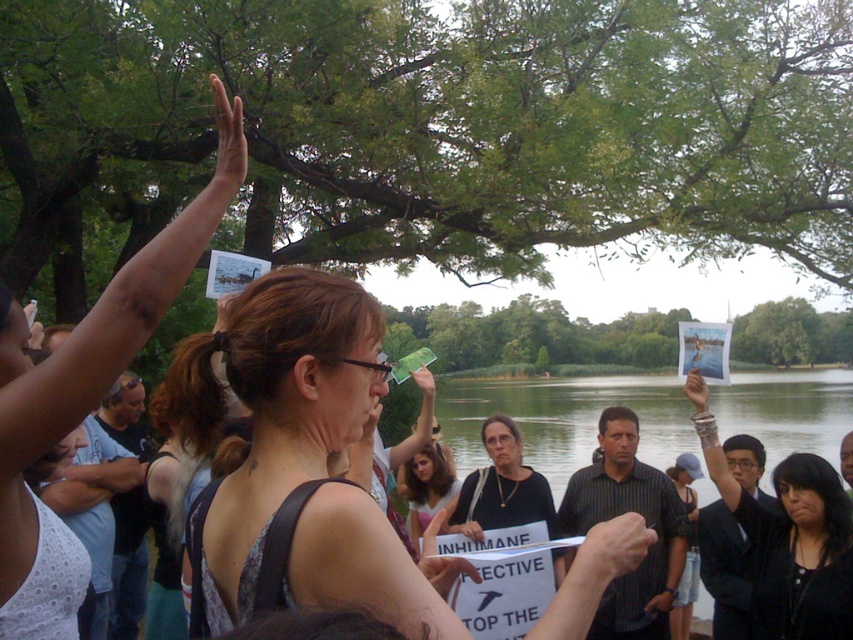
Question: Is green leafy tree at upper center to the right of black fabric shirt at upper center from the viewer's perspective?

Choices:
 (A) no
 (B) yes

Answer: (A)

Question: Is the position of matte black tank top at upper left more distant than that of denim shorts at lower right?

Choices:
 (A) no
 (B) yes

Answer: (A)

Question: Which of these objects is positioned farthest from the matte black tank top at upper left?

Choices:
 (A) denim shorts at lower right
 (B) matte black tank top at center
 (C) brown hair at center
 (D) black fabric shirt at upper center

Answer: (A)

Question: Among these objects, which one is farthest from the camera?

Choices:
 (A) green leafy tree at upper center
 (B) matte black tank top at center
 (C) matte black tank top at upper left

Answer: (A)

Question: Among these points, which one is nearest to the camera?

Choices:
 (A) (202, 387)
 (B) (223, 145)
 (C) (436, 502)
 (D) (682, 618)

Answer: (A)

Question: Does matte black tank top at center have a larger size compared to matte black shirt at center?

Choices:
 (A) yes
 (B) no

Answer: (A)